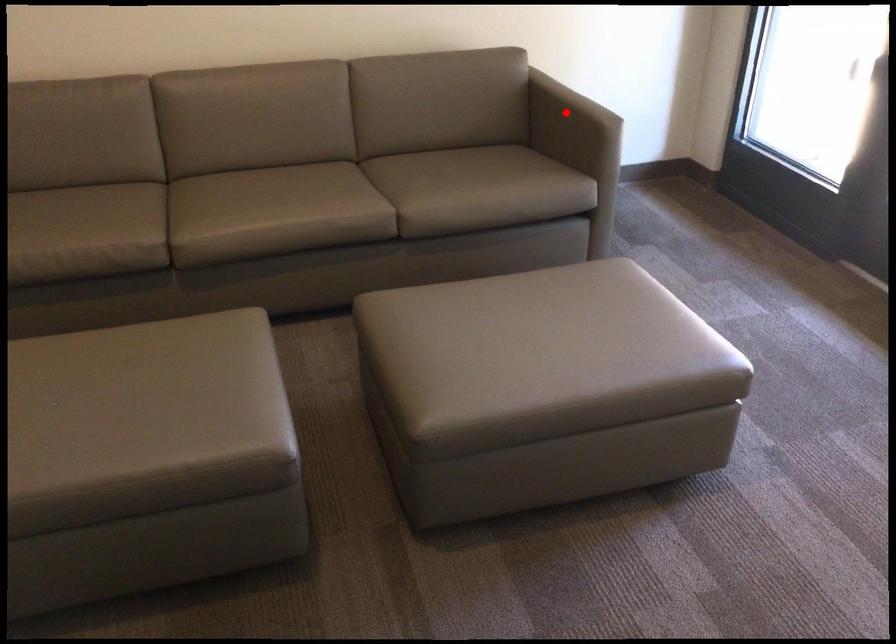
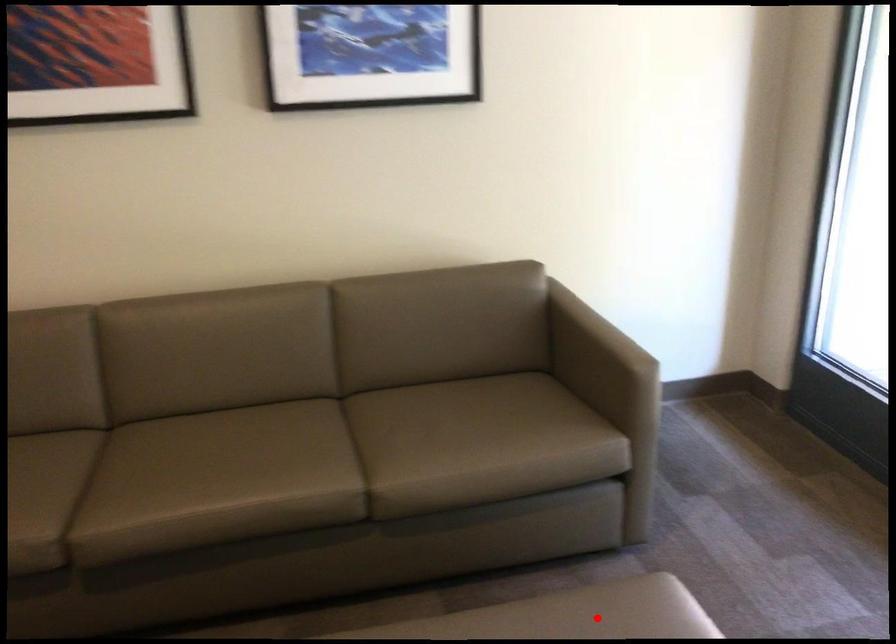
Based on the photo, I am providing you with two images of the same scene from different viewpoints. A red point is marked on the first image and another point is marked on the second image. Is the red point in image1 aligned with the point shown in image2?

No